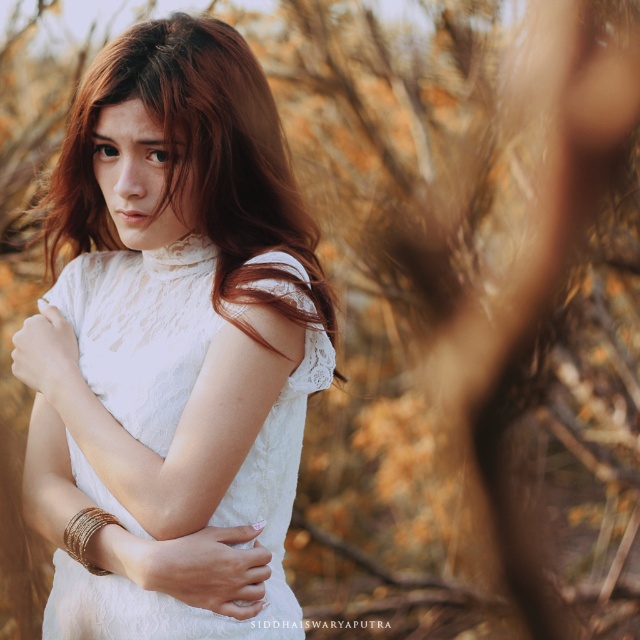
You are a fashion designer observing the person in the image. You need to determine if the white lace dress at center can be seen above the gold metallic bangles at center when viewed from the front. Can you confirm this?

The white lace dress at center is taller than gold metallic bangles at center, so yes, the white lace dress at center can be seen above the gold metallic bangles at center when viewed from the front.

Based on the scene description, where is the white lace dress at center located in terms of its 2D coordinates?

The white lace dress at center is located at the 2D coordinates of point (173, 324).